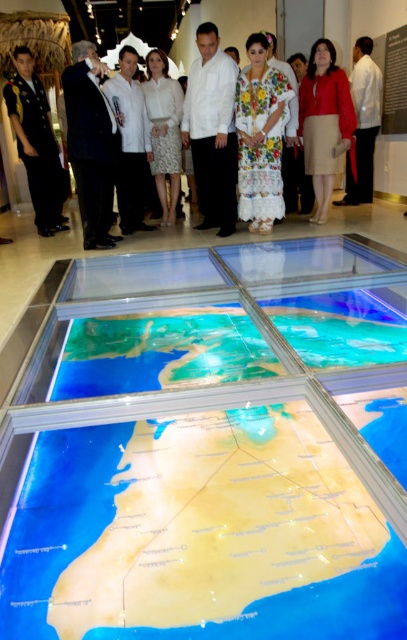
Question: Estimate the real-world distances between objects in this image. Which object is closer to the white lace dress at upper center?

Choices:
 (A) black suit at center
 (B) embroidered fabric dress at center
 (C) white textured dress at center

Answer: (C)

Question: Can you confirm if white matte shirt at center is thinner than white cotton dress at center?

Choices:
 (A) no
 (B) yes

Answer: (A)

Question: Does embroidered fabric dress at center appear under white cotton dress at upper center?

Choices:
 (A) no
 (B) yes

Answer: (B)

Question: Which of the following is the closest to the observer?

Choices:
 (A) (129, 132)
 (B) (54, 147)
 (C) (203, 74)
 (D) (328, 170)

Answer: (C)

Question: Is white matte shirt at center smaller than embroidered fabric dress at center?

Choices:
 (A) yes
 (B) no

Answer: (B)

Question: Which point appears farthest from the camera in this image?

Choices:
 (A) [x=306, y=68]
 (B) [x=41, y=104]
 (C) [x=249, y=106]

Answer: (A)